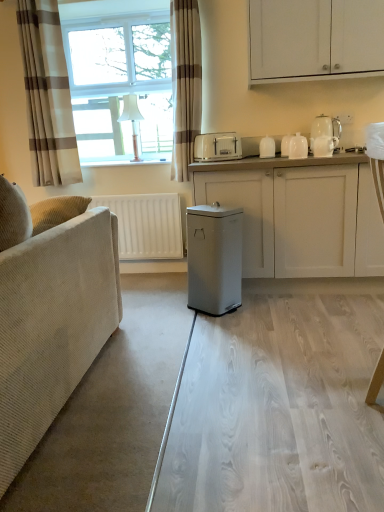
Question: Can we say white plastic toaster at center, the first appliance from the left, lies outside transparent glass table at center?

Choices:
 (A) no
 (B) yes

Answer: (B)

Question: Does white plastic toaster at center, the first appliance from the left, have a greater height compared to transparent glass table at center?

Choices:
 (A) no
 (B) yes

Answer: (B)

Question: Can transparent glass table at center be found inside white plastic toaster at center, placed as the 4th appliance when sorted from right to left?

Choices:
 (A) no
 (B) yes

Answer: (A)

Question: Considering the relative positions of white plastic toaster at center, placed as the 4th appliance when sorted from right to left, and transparent glass table at center in the image provided, is white plastic toaster at center, placed as the 4th appliance when sorted from right to left, to the right of transparent glass table at center from the viewer's perspective?

Choices:
 (A) no
 (B) yes

Answer: (A)

Question: Can you confirm if white plastic toaster at center, the first appliance from the left, is positioned to the left of transparent glass table at center?

Choices:
 (A) no
 (B) yes

Answer: (B)

Question: Is white plastic toaster at center, placed as the 4th appliance when sorted from right to left, positioned with its back to transparent glass table at center?

Choices:
 (A) yes
 (B) no

Answer: (B)

Question: Is white glossy teapot at upper right, placed as the 3th appliance when sorted from right to left, looking in the opposite direction of white glossy jar at upper right, acting as the 3th appliance starting from the left?

Choices:
 (A) no
 (B) yes

Answer: (A)

Question: Is white glossy teapot at upper right, placed as the 3th appliance when sorted from right to left, not near white glossy jar at upper right, acting as the 3th appliance starting from the left?

Choices:
 (A) no
 (B) yes

Answer: (A)

Question: Considering the relative sizes of white glossy teapot at upper right, placed as the 3th appliance when sorted from right to left, and white glossy jar at upper right, acting as the 3th appliance starting from the left, in the image provided, is white glossy teapot at upper right, placed as the 3th appliance when sorted from right to left, wider than white glossy jar at upper right, acting as the 3th appliance starting from the left,?

Choices:
 (A) yes
 (B) no

Answer: (B)

Question: From the image's perspective, would you say white glossy teapot at upper right, which is the 2th appliance from left to right, is shown under white glossy jar at upper right, acting as the 3th appliance starting from the left?

Choices:
 (A) no
 (B) yes

Answer: (A)

Question: Can you confirm if white glossy teapot at upper right, placed as the 3th appliance when sorted from right to left, is thinner than white glossy jar at upper right, marked as the second appliance in a right-to-left arrangement?

Choices:
 (A) yes
 (B) no

Answer: (A)

Question: Can white glossy jar at upper right, marked as the second appliance in a right-to-left arrangement, be found inside white glossy teapot at upper right, placed as the 3th appliance when sorted from right to left?

Choices:
 (A) no
 (B) yes

Answer: (A)

Question: Can you confirm if white glossy coffee machine at upper right is wider than transparent glass table at center?

Choices:
 (A) yes
 (B) no

Answer: (B)